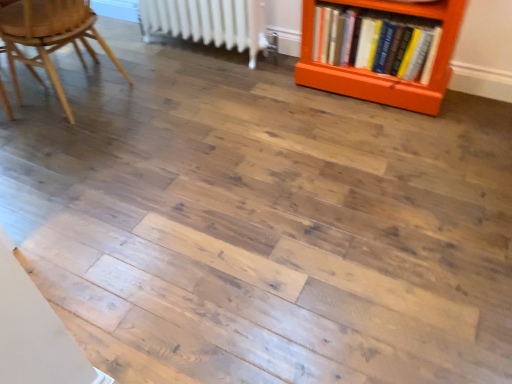
Locate an element on the screen. The width and height of the screenshot is (512, 384). vacant area that lies between wooden chair at left and white metallic radiator at upper center is located at coordinates (176, 83).